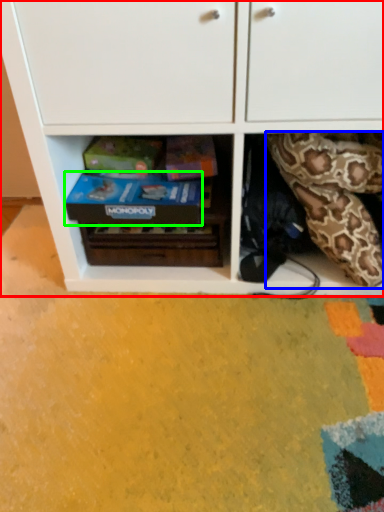
Question: Which object is positioned farthest from cabinetry (highlighted by a red box)? Select from snake (highlighted by a blue box) and shoe box (highlighted by a green box).

Choices:
 (A) snake
 (B) shoe box

Answer: (A)